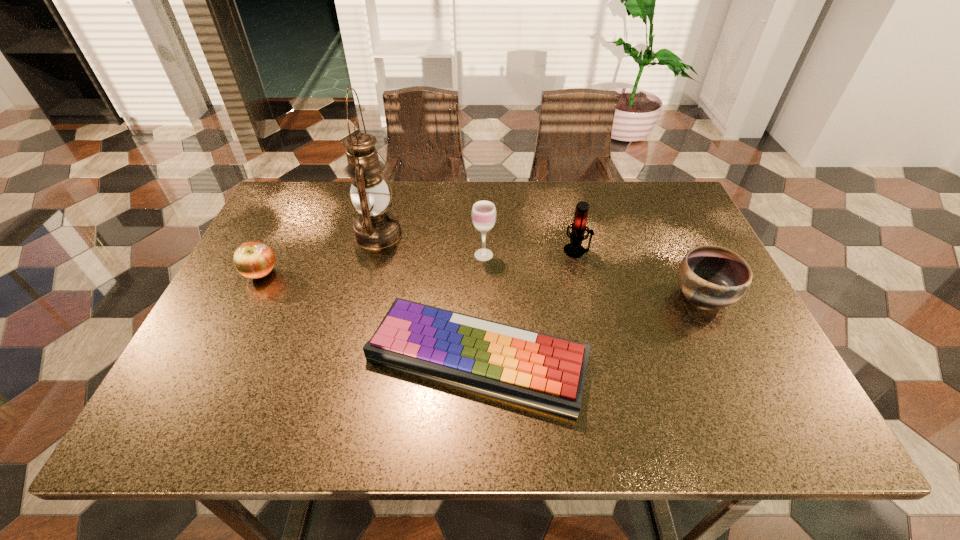
At what (x,y) coordinates should I click in order to perform the action: click on free space located on the back of the microphone. Please return your answer as a coordinate pair (x, y). This screenshot has width=960, height=540. Looking at the image, I should click on (564, 195).

Image resolution: width=960 pixels, height=540 pixels. Identify the location of vacant space positioned on the front of the rightmost object. (730, 352).

Where is `free location located on the right of the fifth tallest object`? Image resolution: width=960 pixels, height=540 pixels. free location located on the right of the fifth tallest object is located at coordinates (402, 274).

Find the location of a particular element. The image size is (960, 540). free region located on the back of the computer keyboard is located at coordinates (478, 206).

You are a GUI agent. You are given a task and a screenshot of the screen. Output one action in this format:
    pyautogui.click(x=<x>, y=<y>)
    Task: Click on the object situated at the far edge
    The width and height of the screenshot is (960, 540).
    Given the screenshot: What is the action you would take?
    pyautogui.click(x=376, y=227)

Where is `object positioned at the near edge`? The image size is (960, 540). object positioned at the near edge is located at coordinates (542, 371).

Identify the location of object at the left edge. The image size is (960, 540). (255, 260).

Where is `object positioned at the right edge`? Image resolution: width=960 pixels, height=540 pixels. object positioned at the right edge is located at coordinates (710, 276).

In the image, there is a desktop. Where is `vacant space at the far edge`? The height and width of the screenshot is (540, 960). vacant space at the far edge is located at coordinates (393, 197).

Image resolution: width=960 pixels, height=540 pixels. In the image, there is a desktop. Identify the location of vacant space at the right edge. (697, 330).